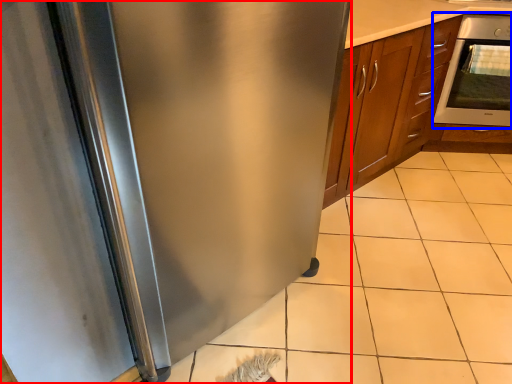
Question: Among these objects, which one is nearest to the camera, refrigerator (highlighted by a red box) or oven (highlighted by a blue box)?

Choices:
 (A) refrigerator
 (B) oven

Answer: (A)